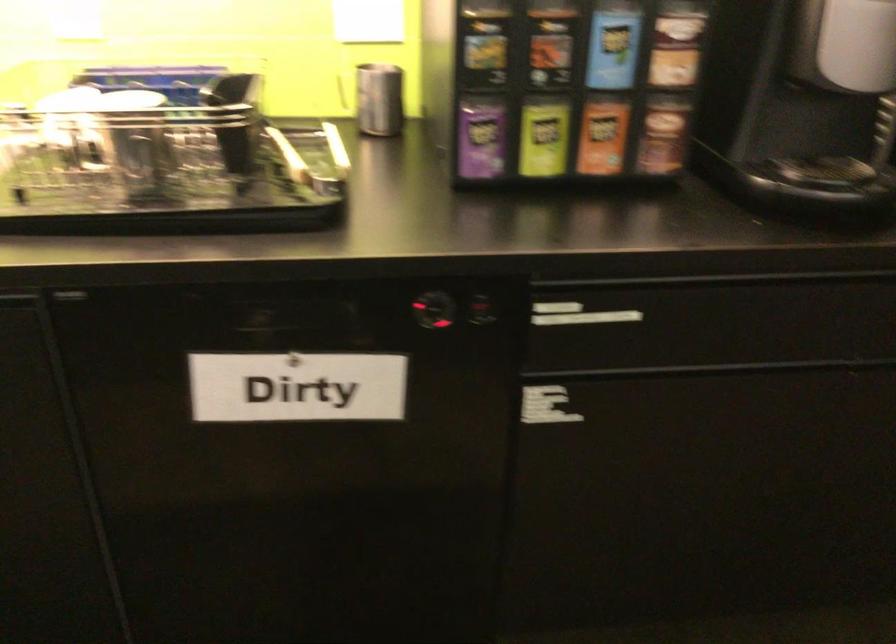
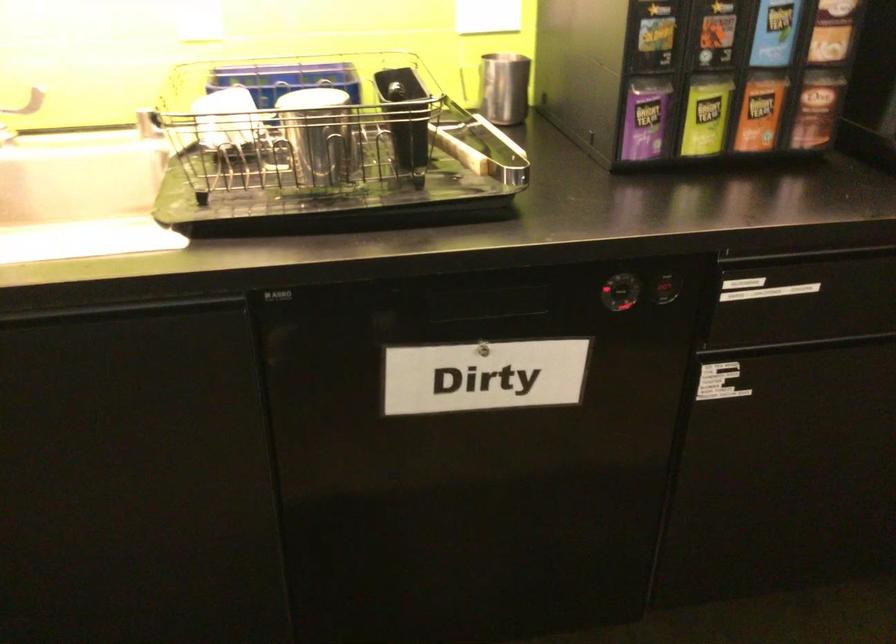
Locate, in the second image, the point that corresponds to (x=600, y=136) in the first image.

(760, 111)